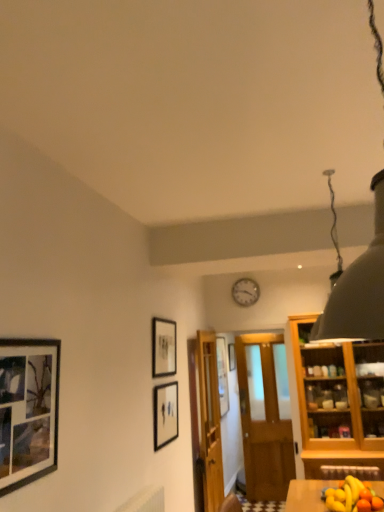
Question: Is white matte lampshade at upper right wider or thinner than matte black picture frame at upper center, which appears as the 2th picture frame when viewed from the left?

Choices:
 (A) wide
 (B) thin

Answer: (A)

Question: Is white matte lampshade at upper right in front of or behind matte black picture frame at upper center, which is the 3th picture frame in back-to-front order, in the image?

Choices:
 (A) behind
 (B) front

Answer: (B)

Question: Which is nearer to the matte black picture frame at left, which is the fifth picture frame in right-to-left order?

Choices:
 (A) wooden table at lower right
 (B) wooden door at center, the 1th door when ordered from right to left
 (C) matte black picture frame at center, which ranks as the 2th picture frame in front-to-back order
 (D) white matte lampshade at upper right
 (E) metallic clock at upper center, acting as the fourth picture frame starting from the front

Answer: (D)

Question: Estimate the real-world distances between objects in this image. Which object is farther from the black matte picture frame at upper center, acting as the fifth picture frame starting from the front?

Choices:
 (A) matte black picture frame at center, positioned as the 3th picture frame in right-to-left order
 (B) wooden table at lower right
 (C) wooden door at center, the 1th door when ordered from right to left
 (D) wooden door at center, which is the 2th door in right-to-left order
 (E) white matte lampshade at upper right

Answer: (E)